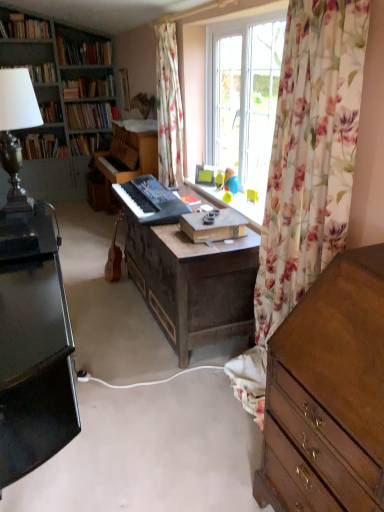
Question: Considering the positions of wooden chest of drawers at right and brown wooden guitar at center in the image, is wooden chest of drawers at right wider or thinner than brown wooden guitar at center?

Choices:
 (A) thin
 (B) wide

Answer: (B)

Question: From their relative heights in the image, would you say wooden chest of drawers at right is taller or shorter than brown wooden guitar at center?

Choices:
 (A) tall
 (B) short

Answer: (A)

Question: Which object is the closest to the wooden bookcase at left?

Choices:
 (A) matte black lamp at upper left, the third book from the bottom
 (B) wooden desk at center
 (C) metallic silver lampshade at upper left
 (D) hardcover book at center, acting as the fourth book starting from the top
 (E) wooden chest of drawers at right

Answer: (D)

Question: Which object is positioned farthest from the wooden desk at center?

Choices:
 (A) hardcover book at center, which is the fourth book in bottom-to-top order
 (B) hardcover books at upper left, which ranks as the 2th book in top-to-bottom order
 (C) black matte keyboard at center
 (D) hardcover books at upper left, the 1th book viewed from the top
 (E) brown wooden guitar at center

Answer: (B)